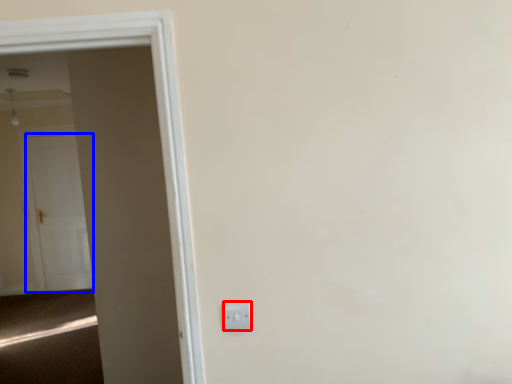
Question: Which object appears farthest to the camera in this image, electric outlet (highlighted by a red box) or door (highlighted by a blue box)?

Choices:
 (A) electric outlet
 (B) door

Answer: (B)